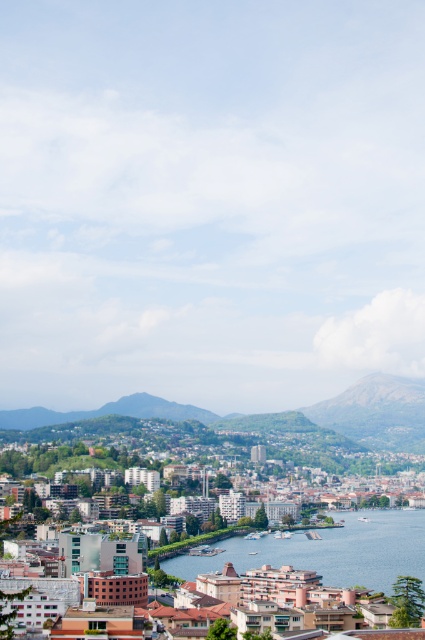
Can you confirm if matte brown buildings at center is thinner than clear blue water at center?

In fact, matte brown buildings at center might be wider than clear blue water at center.

Which of these two, matte brown buildings at center or clear blue water at center, stands shorter?

Standing shorter between the two is clear blue water at center.

Between point (214, 564) and point (407, 554), which one is positioned in front?

Point (214, 564) is in front.

I want to click on matte brown buildings at center, so click(322, 563).